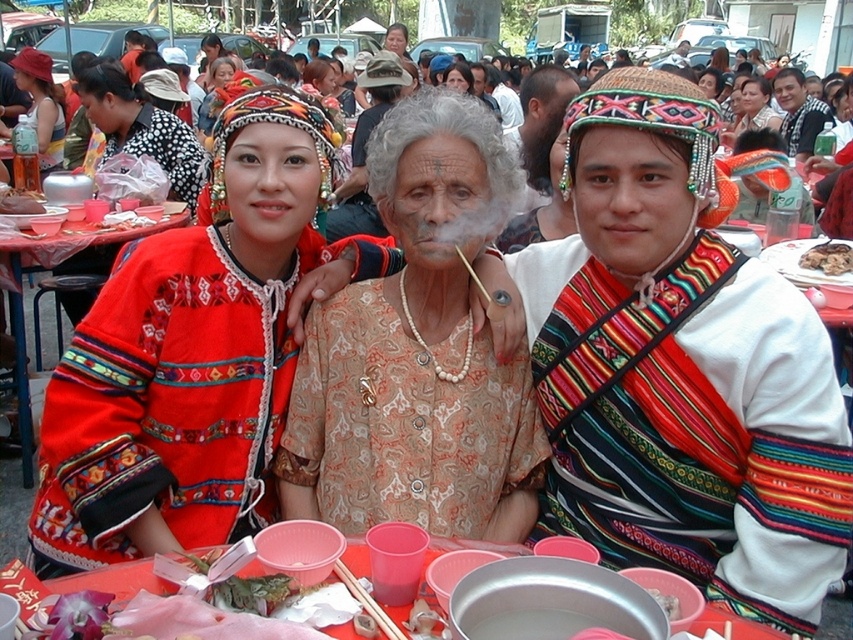
You are a photographer at the event and want to capture a photo of both the red embroidered sweater at left and the patterned fabric blouse at center. Which one will appear closer to the camera in the photo?

The red embroidered sweater at left will appear closer to the camera because it is in front of the patterned fabric blouse at center.

You are standing at the event and want to place a 3 feet long offering on the red fabric table at center. Is the distance between you and the table sufficient to comfortably walk towards it and place the offering without needing to stretch?

The distance between you and the red fabric table at center is 10.86 feet. Since the offering is only 3 feet long, the distance is more than enough to comfortably walk towards the table and place the offering without stretching.